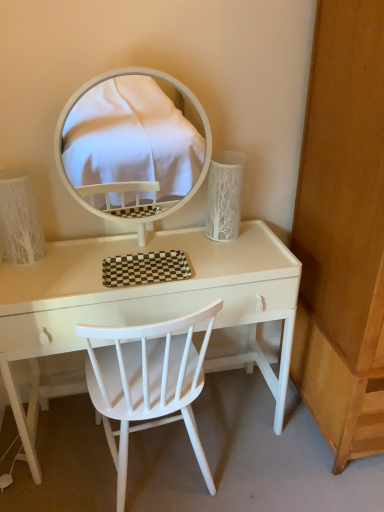
At what (x,y) coordinates should I click in order to perform the action: click on free space between white textured lampshade at left, marked as the first table lamp in a left-to-right arrangement, and white textured vase at right, which is the 2th table lamp from left to right. Please return your answer as a coordinate pair (x, y). Looking at the image, I should click on (124, 248).